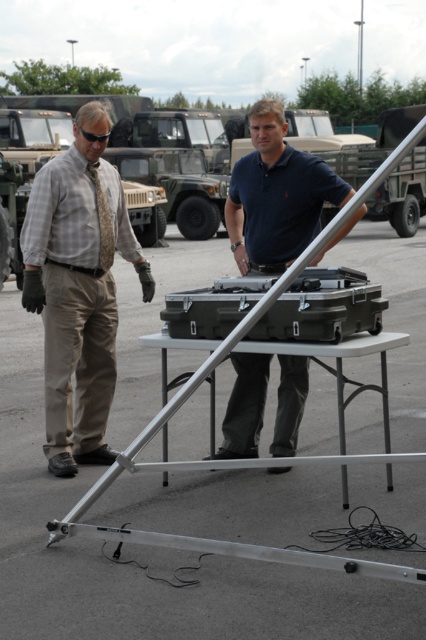
Question: Can you confirm if dark blue polo shirt at center is thinner than matte black case at center?

Choices:
 (A) yes
 (B) no

Answer: (A)

Question: Which object is the closest to the gold textured tie at left?

Choices:
 (A) dark blue polo shirt at center
 (B) matte black case at center

Answer: (A)

Question: Is dark blue polo shirt at center wider than gold textured tie at left?

Choices:
 (A) yes
 (B) no

Answer: (A)

Question: Is plaid shirt at left thinner than matte black case at center?

Choices:
 (A) yes
 (B) no

Answer: (A)

Question: Which object appears closest to the camera in this image?

Choices:
 (A) dark blue polo shirt at center
 (B) plaid shirt at left
 (C) gold textured tie at left

Answer: (A)

Question: Estimate the real-world distances between objects in this image. Which object is closer to the plaid shirt at left?

Choices:
 (A) matte black case at center
 (B) dark blue polo shirt at center

Answer: (B)